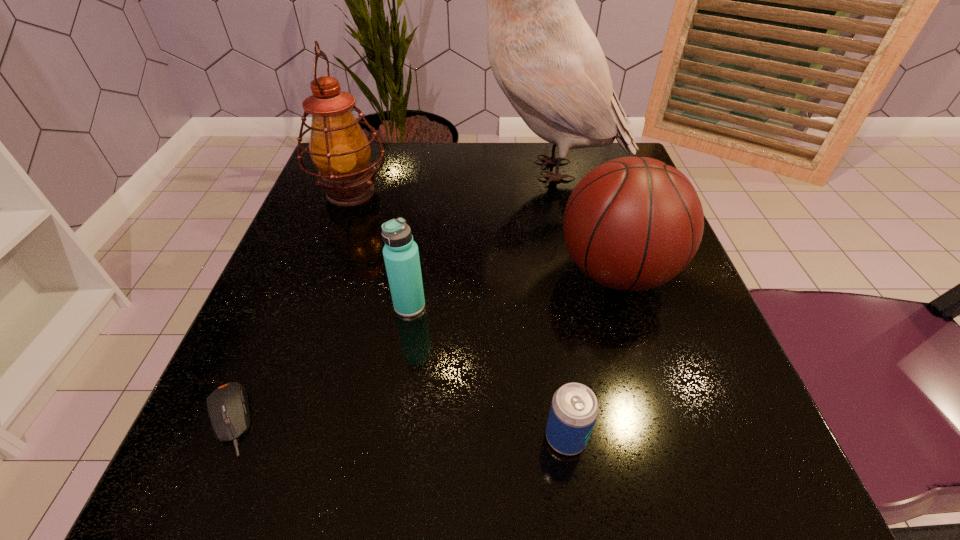
The image size is (960, 540). Find the location of `computer mouse positioned at the left edge`. computer mouse positioned at the left edge is located at coordinates (228, 408).

The width and height of the screenshot is (960, 540). I want to click on parakeet that is at the right edge, so click(544, 56).

Image resolution: width=960 pixels, height=540 pixels. Find the location of `basketball that is at the right edge`. basketball that is at the right edge is located at coordinates (633, 223).

Image resolution: width=960 pixels, height=540 pixels. In order to click on object located at the far left corner in this screenshot , I will do (340, 150).

Image resolution: width=960 pixels, height=540 pixels. What are the coordinates of `object that is at the near left corner` in the screenshot? It's located at (228, 408).

In order to click on object that is at the far right corner in this screenshot , I will do `click(544, 56)`.

Where is `blank space at the far edge of the desktop`? blank space at the far edge of the desktop is located at coordinates (441, 178).

Find the location of `vacant area at the near edge of the desktop`. vacant area at the near edge of the desktop is located at coordinates (367, 466).

This screenshot has width=960, height=540. I want to click on vacant space at the left edge, so click(x=271, y=339).

The height and width of the screenshot is (540, 960). I want to click on free region at the right edge of the desktop, so (x=631, y=300).